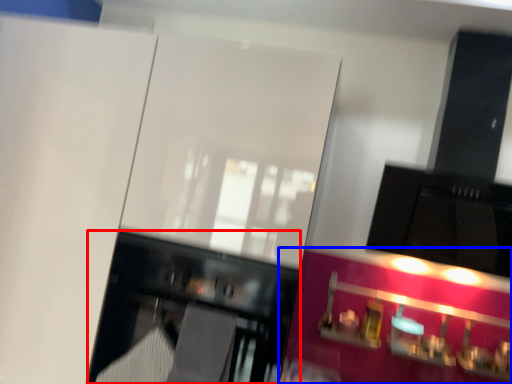
Question: Among these objects, which one is nearest to the camera, furniture (highlighted by a red box) or cabinetry (highlighted by a blue box)?

Choices:
 (A) furniture
 (B) cabinetry

Answer: (A)